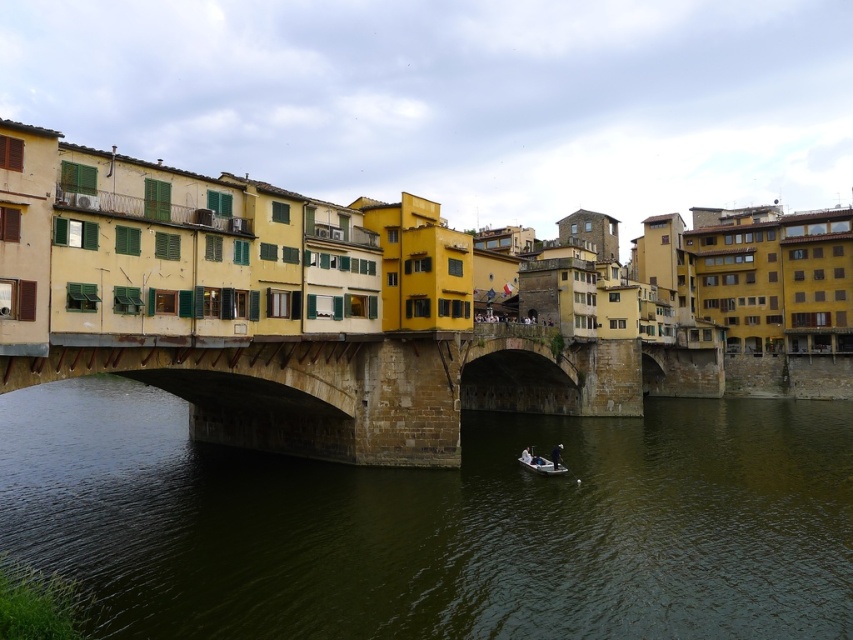
Question: Does greenish-brown water at center have a lesser width compared to stone bridge at center?

Choices:
 (A) yes
 (B) no

Answer: (B)

Question: Does greenish-brown water at center come in front of white plastic boat at lower center?

Choices:
 (A) no
 (B) yes

Answer: (B)

Question: Can you confirm if greenish-brown water at center is positioned below white plastic boat at lower center?

Choices:
 (A) no
 (B) yes

Answer: (A)

Question: Among these objects, which one is nearest to the camera?

Choices:
 (A) stone bridge at center
 (B) greenish-brown water at center

Answer: (B)

Question: Among these points, which one is nearest to the camera?

Choices:
 (A) (535, 458)
 (B) (630, 412)
 (C) (340, 483)

Answer: (C)

Question: Which point appears farthest from the camera in this image?

Choices:
 (A) (534, 468)
 (B) (49, 413)
 (C) (136, 369)

Answer: (B)